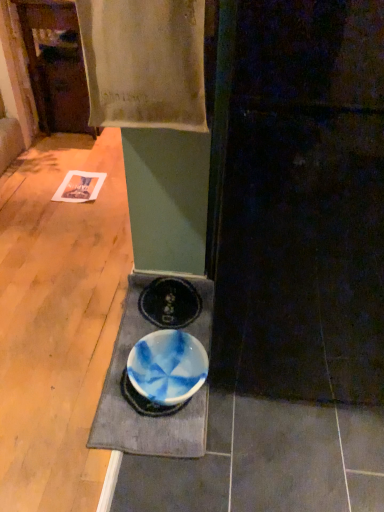
This screenshot has height=512, width=384. Find the location of `free spot in front of smooth dark wood door at center`. free spot in front of smooth dark wood door at center is located at coordinates (272, 462).